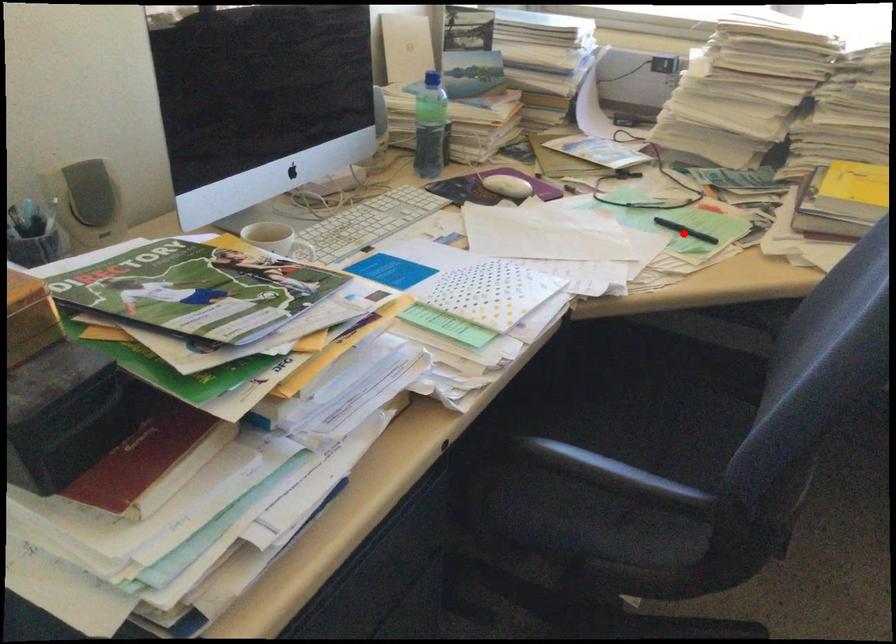
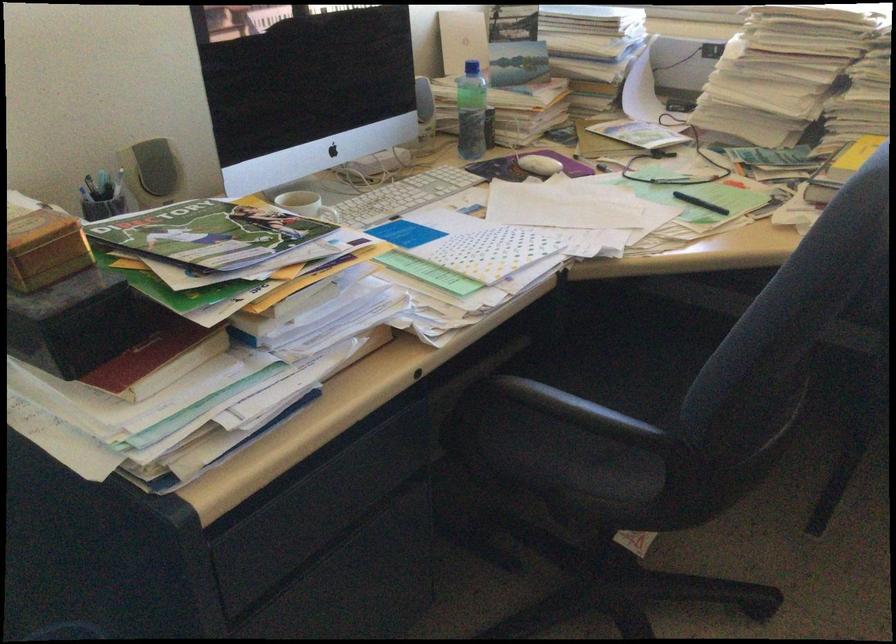
In the second image, find the point that corresponds to the highlighted location in the first image.

(700, 203)